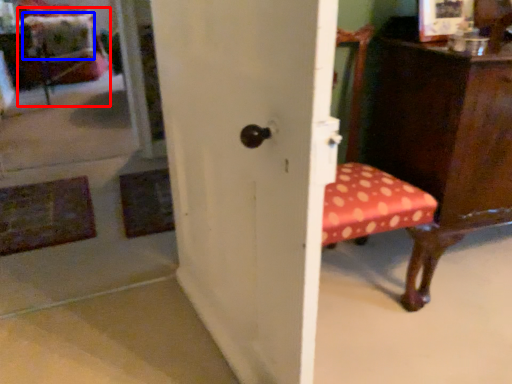
Question: Which object appears farthest to the camera in this image, swivel chair (highlighted by a red box) or pillow (highlighted by a blue box)?

Choices:
 (A) swivel chair
 (B) pillow

Answer: (B)